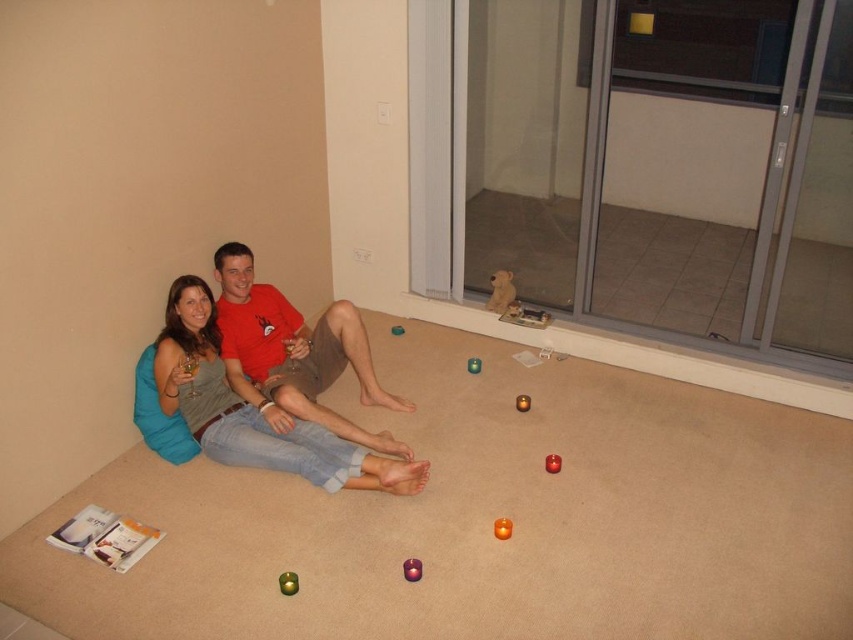
Is point (521, 404) farther from viewer compared to point (469, 371)?

No, (521, 404) is in front of (469, 371).

Is matte brown candle at center thinner than green matte toy at center?

Yes.

The height and width of the screenshot is (640, 853). I want to click on matte brown candle at center, so click(x=521, y=403).

Between shiny purple mouse at center and matte brown candle at center, which one is positioned lower?

Positioned lower is shiny purple mouse at center.

Looking at this image, who is more forward, (x=421, y=576) or (x=517, y=406)?

Point (x=421, y=576) is in front.

Who is more forward, (412, 557) or (515, 401)?

Point (412, 557) is in front.

Locate an element on the screen. Image resolution: width=853 pixels, height=640 pixels. shiny purple mouse at center is located at coordinates (412, 570).

Between green matte toy at center and matte brown teddy bear at center, which one has less height?

Standing shorter between the two is matte brown teddy bear at center.

Locate an element on the screen. The image size is (853, 640). green matte toy at center is located at coordinates (473, 364).

Find the location of a particular element. The image size is (853, 640). green matte toy at center is located at coordinates coord(473,364).